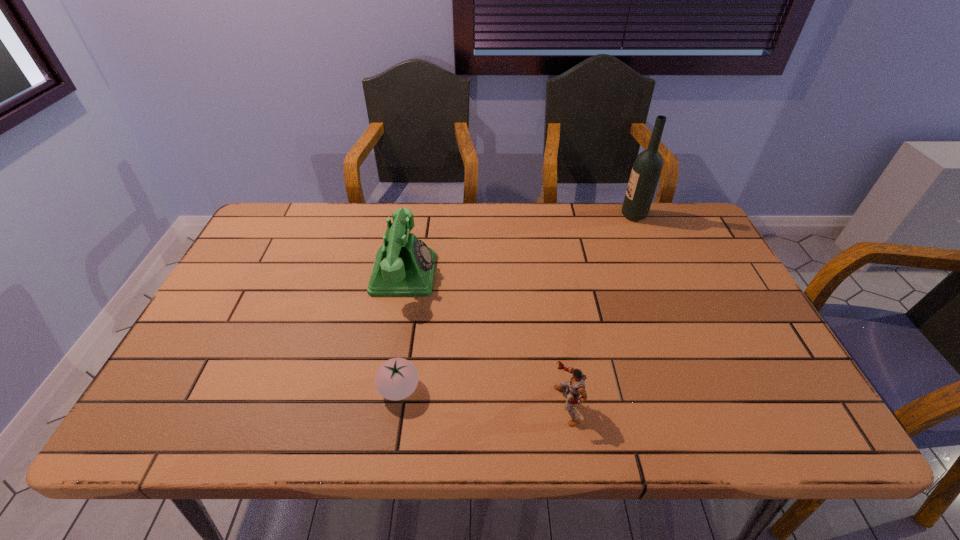
Identify the location of the tallest object. (646, 171).

This screenshot has width=960, height=540. Identify the location of the farthest object. (x=646, y=171).

Find the location of `telephone`. telephone is located at coordinates (404, 266).

Identify the location of the second farthest object. The height and width of the screenshot is (540, 960). (404, 266).

Image resolution: width=960 pixels, height=540 pixels. I want to click on the third object from left to right, so click(x=576, y=386).

Find the location of `the third tallest object`. the third tallest object is located at coordinates (576, 386).

In order to click on tomato in this screenshot , I will do `click(397, 378)`.

Locate an element on the screen. The image size is (960, 540). free point located on the labeled side of the wine bottle is located at coordinates (509, 215).

At what (x,y) coordinates should I click in order to perform the action: click on vacant area situated 0.370m on the labeled side of the wine bottle. Please return your answer as a coordinate pair (x, y). Looking at the image, I should click on (509, 215).

Identify the location of vacant space located 0.110m on the labeled side of the wine bottle. The width and height of the screenshot is (960, 540). (588, 215).